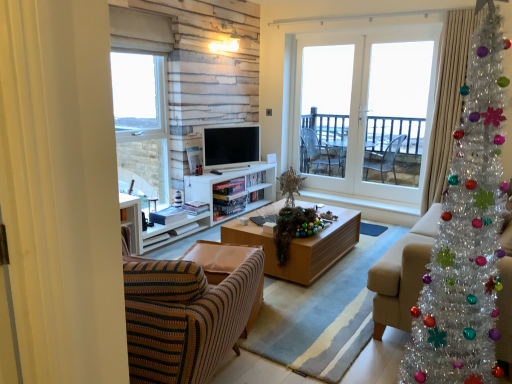
What is the approximate width of white matte entertainment center at center?

The width of white matte entertainment center at center is 37.41 centimeters.

This screenshot has height=384, width=512. Describe the element at coordinates (329, 109) in the screenshot. I see `clear glass door at center, the 2th screen door when ordered from right to left` at that location.

What is the approximate width of white glass door at center, arranged as the second window when viewed from the left?

white glass door at center, arranged as the second window when viewed from the left, is 2.31 inches wide.

This screenshot has width=512, height=384. I want to click on beige fabric couch at right, so click(x=402, y=274).

Where is `white glass screen door at center, arranged as the 2th screen door when viewed from the left`? white glass screen door at center, arranged as the 2th screen door when viewed from the left is located at coordinates [397, 111].

Which of these two, white glass screen door at center, arranged as the 2th screen door when viewed from the left, or wooden coffee table at center, is smaller?

Smaller between the two is white glass screen door at center, arranged as the 2th screen door when viewed from the left.

Can you see white glass screen door at center, which is the first screen door in right-to-left order, touching wooden coffee table at center?

There is a gap between white glass screen door at center, which is the first screen door in right-to-left order, and wooden coffee table at center.

From the image's perspective, is white glass screen door at center, which is the first screen door in right-to-left order, under wooden coffee table at center?

Actually, white glass screen door at center, which is the first screen door in right-to-left order, appears above wooden coffee table at center in the image.

I want to click on coffee table lying below the beige fabric couch at right (from the image's perspective), so click(301, 246).

Which of these two, wooden coffee table at center or beige fabric couch at right, is smaller?

With smaller size is wooden coffee table at center.

Is wooden coffee table at center further to the viewer compared to beige fabric couch at right?

Yes, it is behind beige fabric couch at right.

Visually, is wooden coffee table at center positioned to the left or to the right of beige fabric couch at right?

In the image, wooden coffee table at center appears on the left side of beige fabric couch at right.

Choose the correct answer: Is white matte entertainment center at center inside clear glass window at upper left, the 1th window in the left-to-right sequence, or outside it?

white matte entertainment center at center is not inside clear glass window at upper left, the 1th window in the left-to-right sequence, it's outside.

Find the location of `window that is the 1st one when counting backward from the white matte entertainment center at center`. window that is the 1st one when counting backward from the white matte entertainment center at center is located at coordinates (141, 97).

From a real-world perspective, which object rests below the other?

white matte entertainment center at center is physically lower.

Does point (273, 166) come farther from viewer compared to point (313, 222)?

That is True.

Can you confirm if white matte entertainment center at center is smaller than shiny tinsel garland at center?

Actually, white matte entertainment center at center might be larger than shiny tinsel garland at center.

From the image's perspective, who appears lower, white matte entertainment center at center or shiny tinsel garland at center?

shiny tinsel garland at center.

From a real-world perspective, who is located higher, white matte entertainment center at center or shiny tinsel garland at center?

In real-world perspective, shiny tinsel garland at center is above.

In the scene shown: Is clear glass door at center, the first screen door positioned from the left, directly adjacent to wooden coffee table at center?

No, clear glass door at center, the first screen door positioned from the left, is not with wooden coffee table at center.

Consider the image. Which object is further away from the camera, clear glass door at center, the 2th screen door when ordered from right to left, or wooden coffee table at center?

→ clear glass door at center, the 2th screen door when ordered from right to left, is further away from the camera.

I want to click on coffee table below the clear glass door at center, the 2th screen door when ordered from right to left (from a real-world perspective), so click(301, 246).

Is white glass door at center, which is counted as the 1th window, starting from the right, directly adjacent to wooden coffee table at center?

white glass door at center, which is counted as the 1th window, starting from the right, is not next to wooden coffee table at center, and they're not touching.

Based on the photo, which is more to the right, white glass door at center, arranged as the second window when viewed from the left, or wooden coffee table at center?

white glass door at center, arranged as the second window when viewed from the left, is more to the right.

From a real-world perspective, is white glass door at center, arranged as the second window when viewed from the left, positioned above or below wooden coffee table at center?

white glass door at center, arranged as the second window when viewed from the left, is above wooden coffee table at center.

Looking at this image, which of these two, white glass door at center, arranged as the second window when viewed from the left, or wooden coffee table at center, stands shorter?

Standing shorter between the two is wooden coffee table at center.

Is clear glass door at center, the first screen door positioned from the left, at the left side of white matte entertainment center at center?

No.

Between clear glass door at center, the first screen door positioned from the left, and white matte entertainment center at center, which one has smaller width?

With smaller width is clear glass door at center, the first screen door positioned from the left.

From the image's perspective, relative to white matte entertainment center at center, is clear glass door at center, the 2th screen door when ordered from right to left, above or below?

Clearly, from the image's perspective, clear glass door at center, the 2th screen door when ordered from right to left, is above white matte entertainment center at center.

Is clear glass door at center, the first screen door positioned from the left, further to the viewer compared to white matte entertainment center at center?

Yes, clear glass door at center, the first screen door positioned from the left, is further from the camera.

At what (x,y) coordinates should I click in order to perform the action: click on the 1st screen door above when counting from the wooden coffee table at center (from the image's perspective). Please return your answer as a coordinate pair (x, y). The height and width of the screenshot is (384, 512). Looking at the image, I should click on (397, 111).

Locate an element on the screen. This screenshot has height=384, width=512. coffee table located behind the beige fabric couch at right is located at coordinates (301, 246).

Based on their spatial positions, is white glass screen door at center, which is the first screen door in right-to-left order, or wooden coffee table at center further from beige fabric couch at right?

white glass screen door at center, which is the first screen door in right-to-left order, is further to beige fabric couch at right.

Which object lies nearer to the anchor point shiny tinsel garland at center, silky beige curtain at right or clear glass window at upper left, which is counted as the second window, starting from the right?

silky beige curtain at right is positioned closer to the anchor shiny tinsel garland at center.

Based on their spatial positions, is matte white television at center or beige fabric couch at right closer to clear glass door at center, the first screen door positioned from the left?

matte white television at center.

Estimate the real-world distances between objects in this image. Which object is further from clear glass window at upper left, which is counted as the second window, starting from the right, wooden coffee table at center or clear glass door at center, the 2th screen door when ordered from right to left?

The object further to clear glass window at upper left, which is counted as the second window, starting from the right, is clear glass door at center, the 2th screen door when ordered from right to left.

Based on their spatial positions, is white glass door at center, which is counted as the 1th window, starting from the right, or white matte entertainment center at center further from silky beige curtain at right?

white matte entertainment center at center lies further to silky beige curtain at right than the other object.

When comparing their distances from beige fabric couch at right, does matte white television at center or clear glass window at upper left, which is counted as the second window, starting from the right, seem further?

The object further to beige fabric couch at right is clear glass window at upper left, which is counted as the second window, starting from the right.

Based on their spatial positions, is clear glass window at upper left, the 1th window in the left-to-right sequence, or white matte entertainment center at center further from beige fabric couch at right?

clear glass window at upper left, the 1th window in the left-to-right sequence, is further to beige fabric couch at right.

From the image, which object appears to be farther from silky beige curtain at right, wooden coffee table at center or white glass screen door at center, arranged as the 2th screen door when viewed from the left?

wooden coffee table at center lies further to silky beige curtain at right than the other object.

Locate an element on the screen. The height and width of the screenshot is (384, 512). curtain positioned between shiny metallic christmas tree at right and clear glass door at center, the first screen door positioned from the left, from near to far is located at coordinates (447, 100).

This screenshot has width=512, height=384. I want to click on curtain between beige fabric couch at right and white glass screen door at center, which is the first screen door in right-to-left order, in the front-back direction, so 447,100.

Locate an element on the screen. window between matte white television at center and white glass screen door at center, arranged as the 2th screen door when viewed from the left is located at coordinates (369, 96).

Locate an element on the screen. Image resolution: width=512 pixels, height=384 pixels. window located between white matte entertainment center at center and white glass screen door at center, which is the first screen door in right-to-left order, in the left-right direction is located at coordinates (x=369, y=96).